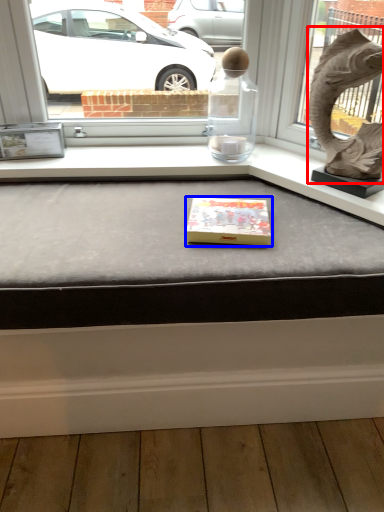
Question: Which object appears farthest to the camera in this image, animal sculpture (highlighted by a red box) or box (highlighted by a blue box)?

Choices:
 (A) animal sculpture
 (B) box

Answer: (B)